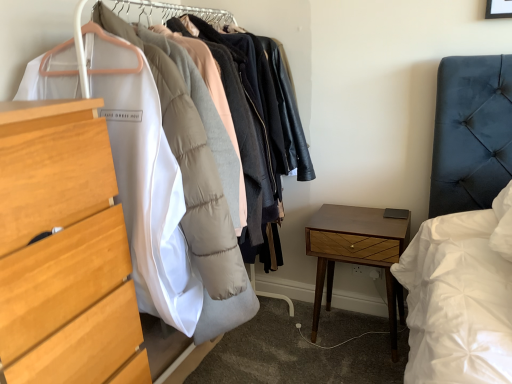
Question: In the image, is light wood chest of drawers at left on the left side or the right side of wooden nightstand at lower right?

Choices:
 (A) left
 (B) right

Answer: (A)

Question: From their relative heights in the image, would you say light wood chest of drawers at left is taller or shorter than wooden nightstand at lower right?

Choices:
 (A) tall
 (B) short

Answer: (A)

Question: From a real-world perspective, is light wood chest of drawers at left positioned above or below wooden nightstand at lower right?

Choices:
 (A) above
 (B) below

Answer: (A)

Question: Is wooden nightstand at lower right taller or shorter than light wood chest of drawers at left?

Choices:
 (A) tall
 (B) short

Answer: (B)

Question: Is point (344, 221) positioned closer to the camera than point (67, 104)?

Choices:
 (A) farther
 (B) closer

Answer: (A)

Question: From the image's perspective, is wooden nightstand at lower right above or below light wood chest of drawers at left?

Choices:
 (A) above
 (B) below

Answer: (B)

Question: Is wooden nightstand at lower right situated inside light wood chest of drawers at left or outside?

Choices:
 (A) inside
 (B) outside

Answer: (B)